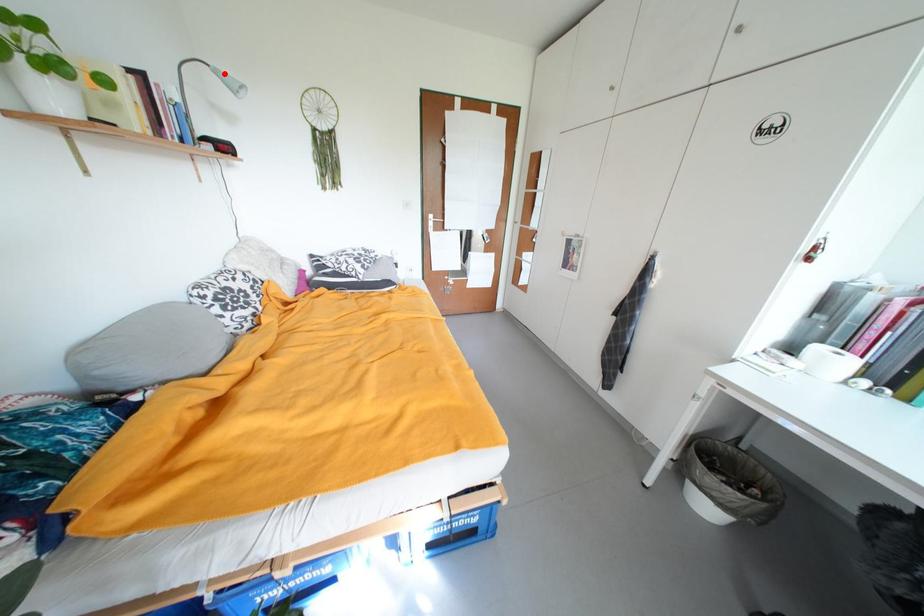
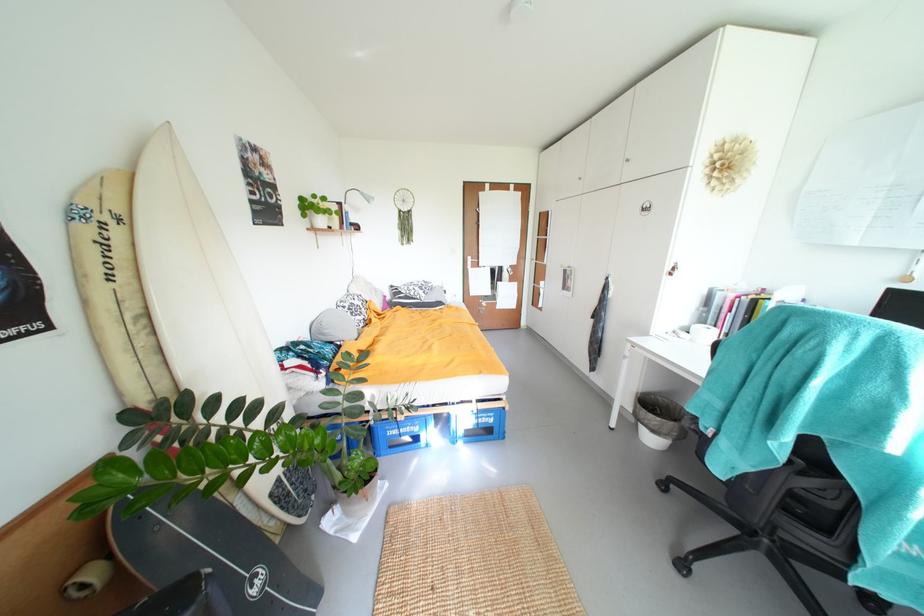
Question: I am providing you with two images of the same scene from different viewpoints. Image1 has a red point marked. In image2, the corresponding 3D location appears at what relative position? Reply with the corresponding letter.

Choices:
 (A) Closer
 (B) Farther

Answer: (A)